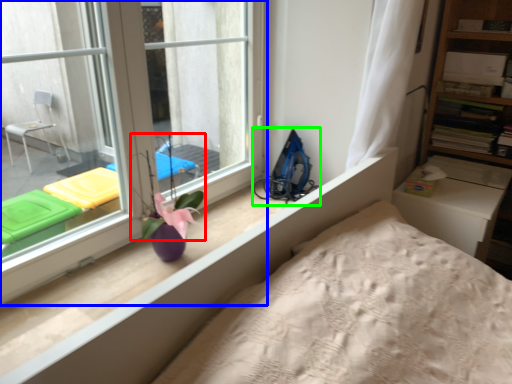
Question: Which is nearer to the plant (highlighted by a red box)? window (highlighted by a blue box) or equipment (highlighted by a green box).

Choices:
 (A) window
 (B) equipment

Answer: (A)